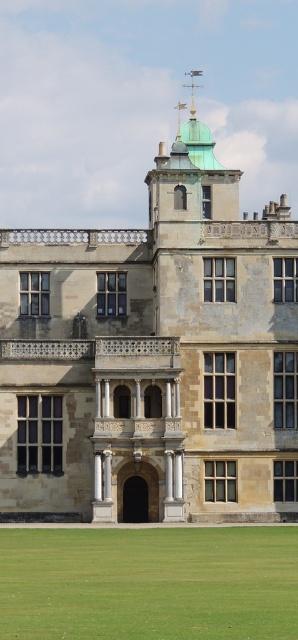
Question: From the image, what is the correct spatial relationship of stone textured palace at center in relation to green grass at lower center?

Choices:
 (A) below
 (B) above

Answer: (B)

Question: Is stone textured palace at center behind green grass at lower center?

Choices:
 (A) no
 (B) yes

Answer: (B)

Question: Does stone textured palace at center have a smaller size compared to green grass at lower center?

Choices:
 (A) no
 (B) yes

Answer: (A)

Question: Which of the following is the farthest from the observer?

Choices:
 (A) (143, 561)
 (B) (219, 301)

Answer: (B)

Question: Which point is closer to the camera?

Choices:
 (A) (115, 385)
 (B) (87, 545)

Answer: (B)

Question: Which point appears farthest from the camera in this image?

Choices:
 (A) (173, 557)
 (B) (173, 516)

Answer: (B)